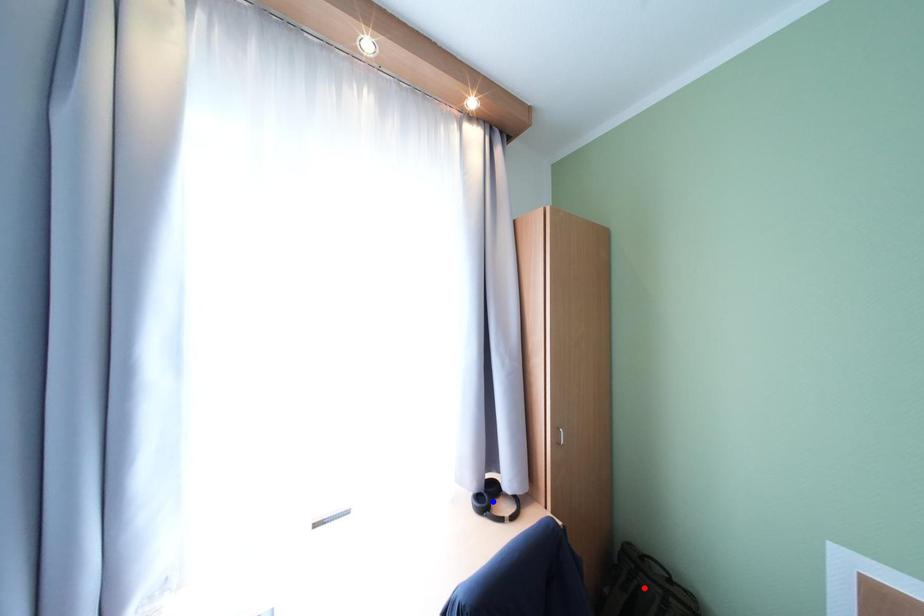
Question: Which of the two points in the image is closer to the camera?

Choices:
 (A) Blue point is closer.
 (B) Red point is closer.

Answer: (B)